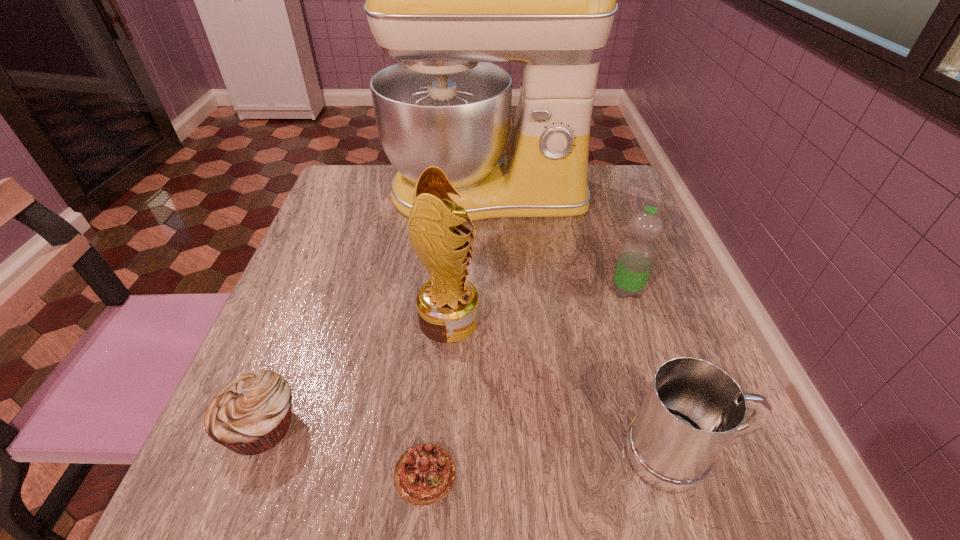
Identify the location of the tallest object. Image resolution: width=960 pixels, height=540 pixels. (446, 0).

Find the location of `the farthest object`. the farthest object is located at coordinates (446, 0).

At what (x,y) coordinates should I click in order to perform the action: click on award. Please return your answer as a coordinate pair (x, y). The width and height of the screenshot is (960, 540). Looking at the image, I should click on (448, 304).

Where is `water bottle`? The image size is (960, 540). water bottle is located at coordinates (637, 255).

Locate an element on the screen. mug is located at coordinates (692, 409).

I want to click on the fifth tallest object, so click(x=250, y=415).

Locate an element on the screen. The width and height of the screenshot is (960, 540). muffin is located at coordinates (250, 415).

Where is `the shortest object`? The width and height of the screenshot is (960, 540). the shortest object is located at coordinates (424, 474).

This screenshot has width=960, height=540. I want to click on free space located 0.320m on the side of the tallest object with the control knob, so click(x=491, y=335).

Identify the location of vacant space located 0.180m on the front-facing side of the award. (575, 320).